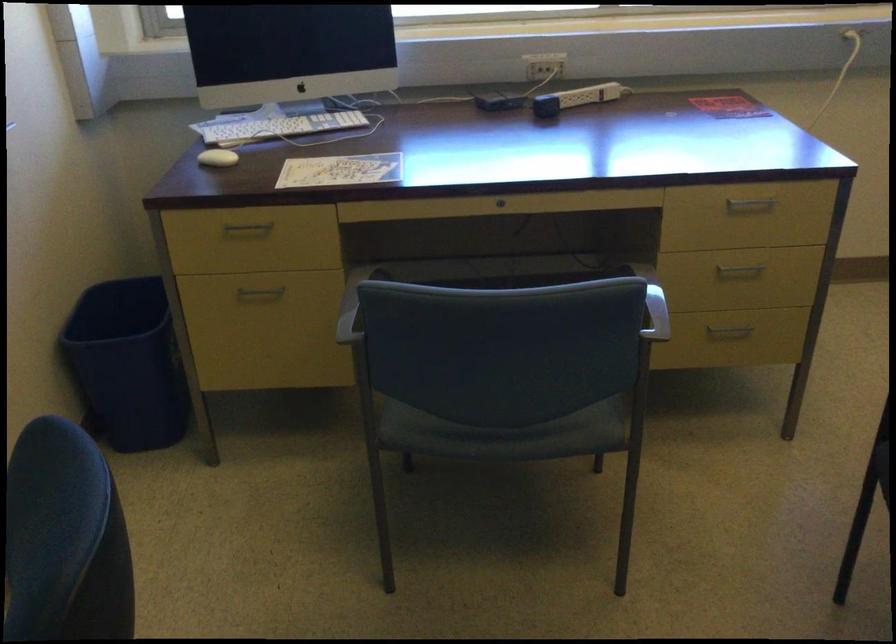
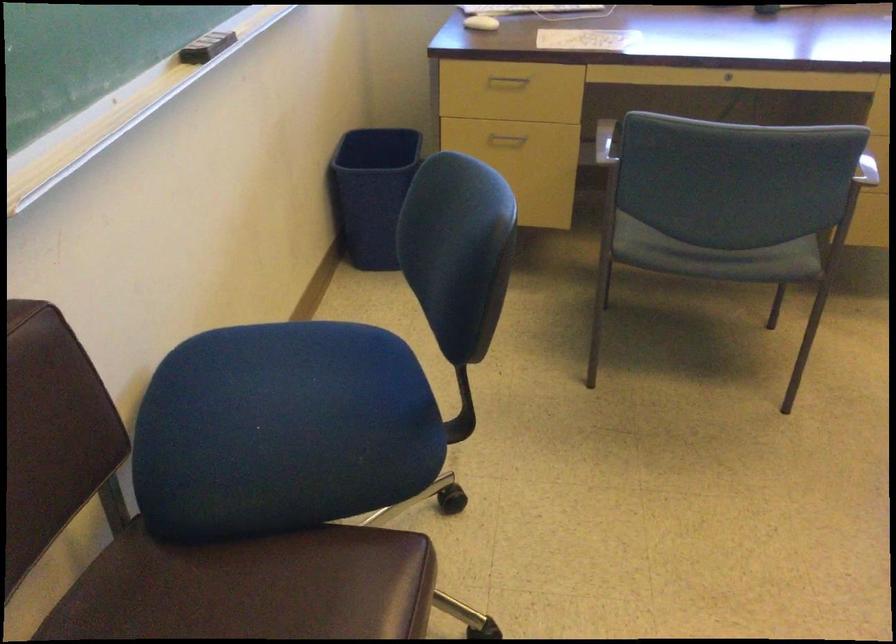
In a continuous first-person perspective shot, in which direction is the camera moving?

The cameraman moved toward left, backward.